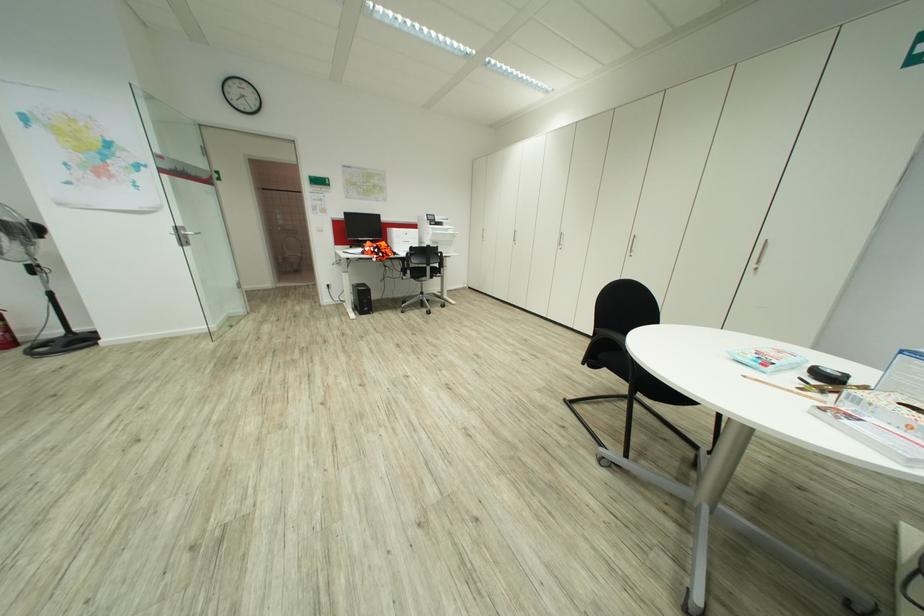
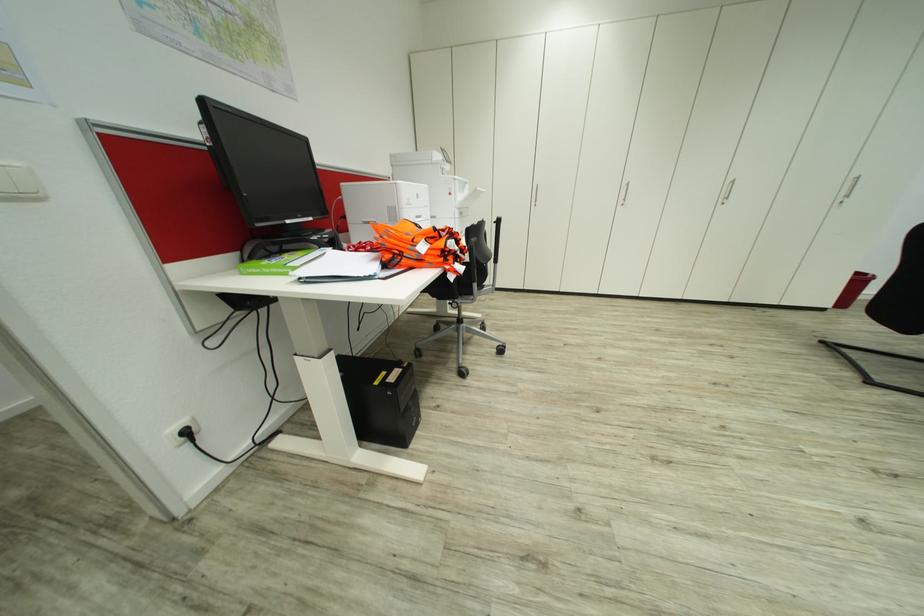
In the second image, find the point that corresponds to (x=758, y=262) in the first image.

(845, 195)